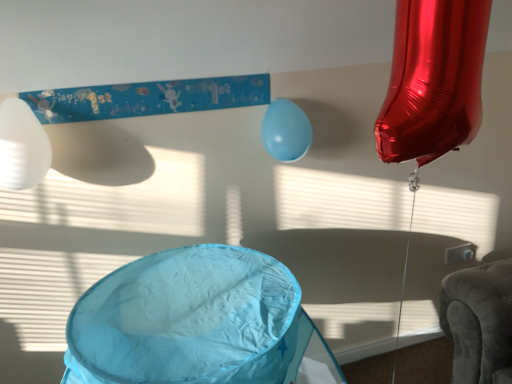
Describe the element at coordinates (22, 146) in the screenshot. I see `white matte balloon at left, acting as the 2th balloon starting from the right` at that location.

Find the location of `white matte balloon at left, positioned as the 1th balloon in front-to-back order`. white matte balloon at left, positioned as the 1th balloon in front-to-back order is located at coordinates [x=22, y=146].

Image resolution: width=512 pixels, height=384 pixels. Describe the element at coordinates (286, 131) in the screenshot. I see `light blue rubber balloon at center, acting as the 2th balloon starting from the front` at that location.

Measure the distance between light blue rubber balloon at center, acting as the 2th balloon starting from the front, and camera.

light blue rubber balloon at center, acting as the 2th balloon starting from the front, and camera are 4.95 feet apart.

In order to face light blue rubber balloon at center, acting as the 2th balloon starting from the front, should I rotate leftwards or rightwards?

You should rotate right by 3.739 degrees.

At what (x,y) coordinates should I click in order to perform the action: click on light blue rubber balloon at center, acting as the 2th balloon starting from the front. Please return your answer as a coordinate pair (x, y). The image size is (512, 384). Looking at the image, I should click on (286, 131).

Where is `white matte balloon at left, the 1th balloon in the left-to-right sequence`? The height and width of the screenshot is (384, 512). white matte balloon at left, the 1th balloon in the left-to-right sequence is located at coordinates (22, 146).

Which is more to the right, white matte balloon at left, acting as the 2th balloon starting from the right, or light blue rubber balloon at center, acting as the 2th balloon starting from the front?

Positioned to the right is light blue rubber balloon at center, acting as the 2th balloon starting from the front.

Considering their positions, is white matte balloon at left, positioned as the 1th balloon in front-to-back order, located in front of or behind light blue rubber balloon at center, the 2th balloon viewed from the left?

Clearly, white matte balloon at left, positioned as the 1th balloon in front-to-back order, is in front of light blue rubber balloon at center, the 2th balloon viewed from the left.

Which is behind, point (5, 113) or point (268, 132)?

The point (268, 132) is farther from the camera.

From the image's perspective, is white matte balloon at left, acting as the 2th balloon starting from the right, positioned above or below light blue rubber balloon at center, the first balloon positioned from the right?

white matte balloon at left, acting as the 2th balloon starting from the right, is situated lower than light blue rubber balloon at center, the first balloon positioned from the right, in the image.

From a real-world perspective, is white matte balloon at left, acting as the 2th balloon starting from the right, positioned under light blue rubber balloon at center, the first balloon positioned from the right, based on gravity?

Actually, white matte balloon at left, acting as the 2th balloon starting from the right, is physically above light blue rubber balloon at center, the first balloon positioned from the right, in the real world.

Is white matte balloon at left, positioned as the 1th balloon in front-to-back order, thinner than light blue rubber balloon at center, the first balloon positioned from the right?

No.

Looking at this image, can you confirm if white matte balloon at left, the 1th balloon in the left-to-right sequence, is shorter than light blue rubber balloon at center, the 2th balloon viewed from the left?

No, white matte balloon at left, the 1th balloon in the left-to-right sequence, is not shorter than light blue rubber balloon at center, the 2th balloon viewed from the left.

Can you confirm if white matte balloon at left, acting as the 2th balloon starting from the right, is smaller than light blue rubber balloon at center, positioned as the 1th balloon in back-to-front order?

Actually, white matte balloon at left, acting as the 2th balloon starting from the right, might be larger than light blue rubber balloon at center, positioned as the 1th balloon in back-to-front order.

Would you say white matte balloon at left, acting as the 2th balloon starting from the right, contains light blue rubber balloon at center, positioned as the 1th balloon in back-to-front order?

Definitely not — light blue rubber balloon at center, positioned as the 1th balloon in back-to-front order, is not inside white matte balloon at left, acting as the 2th balloon starting from the right.

Is white matte balloon at left, positioned as the 1th balloon in front-to-back order, touching light blue rubber balloon at center, positioned as the 1th balloon in back-to-front order?

No, white matte balloon at left, positioned as the 1th balloon in front-to-back order, is not touching light blue rubber balloon at center, positioned as the 1th balloon in back-to-front order.

Is white matte balloon at left, which is the 2th balloon in back-to-front order, turned away from light blue rubber balloon at center, positioned as the 1th balloon in back-to-front order?

No, white matte balloon at left, which is the 2th balloon in back-to-front order, is not facing away from light blue rubber balloon at center, positioned as the 1th balloon in back-to-front order.

Could you measure the distance between white matte balloon at left, positioned as the 1th balloon in front-to-back order, and light blue rubber balloon at center, the first balloon positioned from the right?

white matte balloon at left, positioned as the 1th balloon in front-to-back order, is 31.82 inches from light blue rubber balloon at center, the first balloon positioned from the right.

Where is `balloon that appears behind the white matte balloon at left, which is the 2th balloon in back-to-front order`? The image size is (512, 384). balloon that appears behind the white matte balloon at left, which is the 2th balloon in back-to-front order is located at coordinates (286, 131).

Considering the positions of objects light blue rubber balloon at center, positioned as the 1th balloon in back-to-front order, and white matte balloon at left, acting as the 2th balloon starting from the right, in the image provided, who is more to the right, light blue rubber balloon at center, positioned as the 1th balloon in back-to-front order, or white matte balloon at left, acting as the 2th balloon starting from the right,?

From the viewer's perspective, light blue rubber balloon at center, positioned as the 1th balloon in back-to-front order, appears more on the right side.

Does light blue rubber balloon at center, the 2th balloon viewed from the left, lie behind white matte balloon at left, the 1th balloon in the left-to-right sequence?

Yes, light blue rubber balloon at center, the 2th balloon viewed from the left, is further from the camera.

Which is closer, (296, 135) or (11, 159)?

Clearly, point (296, 135) is more distant from the camera than point (11, 159).

From the image's perspective, between light blue rubber balloon at center, acting as the 2th balloon starting from the front, and white matte balloon at left, positioned as the 1th balloon in front-to-back order, who is located below?

From the image's view, white matte balloon at left, positioned as the 1th balloon in front-to-back order, is below.

From a real-world perspective, does light blue rubber balloon at center, acting as the 2th balloon starting from the front, stand above white matte balloon at left, positioned as the 1th balloon in front-to-back order?

No, from a real-world perspective, light blue rubber balloon at center, acting as the 2th balloon starting from the front, is not on top of white matte balloon at left, positioned as the 1th balloon in front-to-back order.

Is light blue rubber balloon at center, the 2th balloon viewed from the left, wider or thinner than white matte balloon at left, positioned as the 1th balloon in front-to-back order?

In the image, light blue rubber balloon at center, the 2th balloon viewed from the left, appears to be more narrow than white matte balloon at left, positioned as the 1th balloon in front-to-back order.

Considering the sizes of light blue rubber balloon at center, positioned as the 1th balloon in back-to-front order, and white matte balloon at left, acting as the 2th balloon starting from the right, in the image, is light blue rubber balloon at center, positioned as the 1th balloon in back-to-front order, taller or shorter than white matte balloon at left, acting as the 2th balloon starting from the right,?

light blue rubber balloon at center, positioned as the 1th balloon in back-to-front order, is shorter than white matte balloon at left, acting as the 2th balloon starting from the right.

Is light blue rubber balloon at center, the first balloon positioned from the right, smaller than white matte balloon at left, the 1th balloon in the left-to-right sequence?

Yes, light blue rubber balloon at center, the first balloon positioned from the right, is smaller than white matte balloon at left, the 1th balloon in the left-to-right sequence.

Consider the image. Does light blue rubber balloon at center, the first balloon positioned from the right, contain white matte balloon at left, the 1th balloon in the left-to-right sequence?

No.

Is there a large distance between light blue rubber balloon at center, acting as the 2th balloon starting from the front, and white matte balloon at left, positioned as the 1th balloon in front-to-back order?

No, there isn't a large distance between light blue rubber balloon at center, acting as the 2th balloon starting from the front, and white matte balloon at left, positioned as the 1th balloon in front-to-back order.

Is light blue rubber balloon at center, the 2th balloon viewed from the left, facing towards white matte balloon at left, positioned as the 1th balloon in front-to-back order?

No, light blue rubber balloon at center, the 2th balloon viewed from the left, does not turn towards white matte balloon at left, positioned as the 1th balloon in front-to-back order.

How different are the orientations of light blue rubber balloon at center, the first balloon positioned from the right, and white matte balloon at left, positioned as the 1th balloon in front-to-back order, in degrees?

They differ by 0.729 degrees in their facing directions.

This screenshot has width=512, height=384. I want to click on balloon below the light blue rubber balloon at center, acting as the 2th balloon starting from the front (from the image's perspective), so [x=22, y=146].

In order to click on balloon on the left of the light blue rubber balloon at center, positioned as the 1th balloon in back-to-front order in this screenshot , I will do `click(22, 146)`.

You are a GUI agent. You are given a task and a screenshot of the screen. Output one action in this format:
    pyautogui.click(x=<x>, y=<y>)
    Task: Click on the balloon above the light blue rubber balloon at center, positioned as the 1th balloon in back-to-front order (from a real-world perspective)
    This screenshot has width=512, height=384.
    Given the screenshot: What is the action you would take?
    pyautogui.click(x=22, y=146)